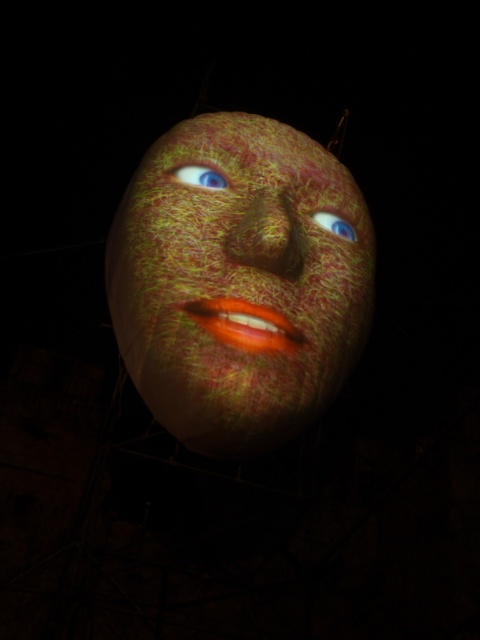
Between matte textured nose at center and blue matte eye at center, which one appears on the left side from the viewer's perspective?

From the viewer's perspective, matte textured nose at center appears more on the left side.

Who is positioned more to the right, matte textured nose at center or blue matte eye at center?

blue matte eye at center

Image resolution: width=480 pixels, height=640 pixels. Describe the element at coordinates (267, 236) in the screenshot. I see `matte textured nose at center` at that location.

At what (x,y) coordinates should I click in order to perform the action: click on matte textured nose at center. Please return your answer as a coordinate pair (x, y). The width and height of the screenshot is (480, 640). Looking at the image, I should click on (267, 236).

Is speckled fabric mask at center below blue matte eye at center?

Yes.

Can you confirm if speckled fabric mask at center is thinner than blue matte eye at center?

No.

I want to click on speckled fabric mask at center, so click(239, 282).

How distant is speckled fabric mask at center from blue glossy eye at upper center?

speckled fabric mask at center is 8.68 feet away from blue glossy eye at upper center.

Is speckled fabric mask at center shorter than blue glossy eye at upper center?

No.

Who is more forward, (180, 220) or (218, 189)?

Point (180, 220)

You are a GUI agent. You are given a task and a screenshot of the screen. Output one action in this format:
    pyautogui.click(x=<x>, y=<y>)
    Task: Click on the speckled fabric mask at center
    The width and height of the screenshot is (480, 640).
    Given the screenshot: What is the action you would take?
    pyautogui.click(x=239, y=282)